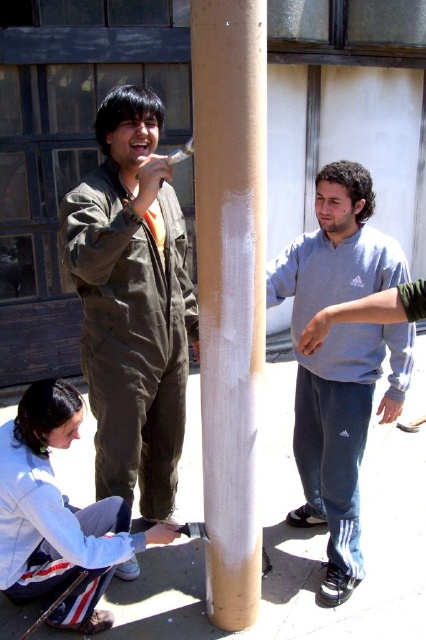
Question: Which point is farther to the camera?

Choices:
 (A) smooth concrete pavement at lower center
 (B) matte green jumpsuit at center

Answer: (A)

Question: Which is nearer to the smooth concrete pavement at lower center?

Choices:
 (A) smooth brown pole at center
 (B) white matte jacket at lower left

Answer: (B)

Question: Does smooth brown pole at center appear over gray sweatshirt at center?

Choices:
 (A) no
 (B) yes

Answer: (B)

Question: Can you confirm if gray sweatshirt at center is positioned below white matte jacket at lower left?

Choices:
 (A) yes
 (B) no

Answer: (B)

Question: Estimate the real-world distances between objects in this image. Which object is farther from the gray sweatshirt at center?

Choices:
 (A) smooth concrete pavement at lower center
 (B) matte green jumpsuit at center

Answer: (A)

Question: Is smooth concrete pavement at lower center positioned in front of smooth brown pole at center?

Choices:
 (A) no
 (B) yes

Answer: (A)